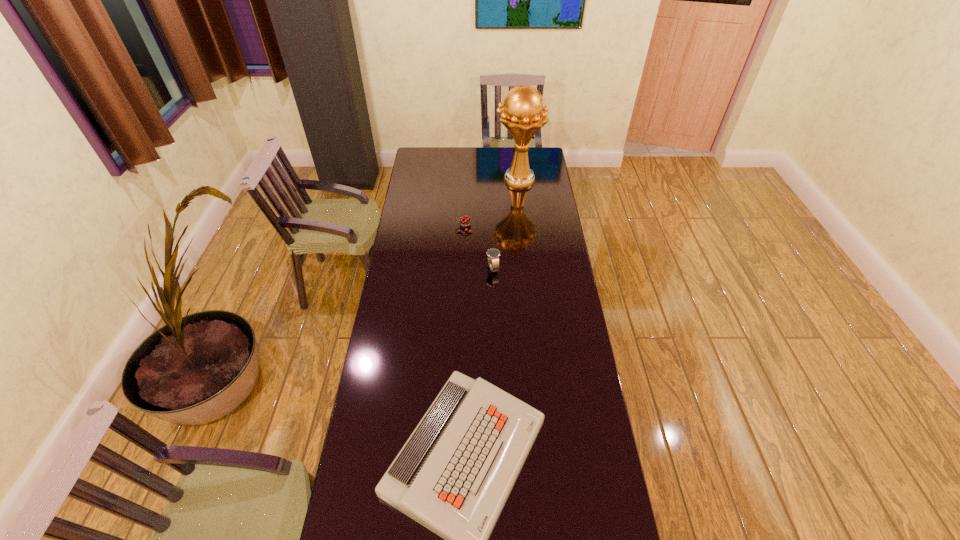
Find the location of a particular element. The height and width of the screenshot is (540, 960). vacant space situated on the handle side of the cherry is located at coordinates (427, 228).

Locate an element on the screen. This screenshot has height=540, width=960. object that is at the far edge is located at coordinates (523, 114).

The image size is (960, 540). I want to click on object at the right edge, so click(523, 114).

You are a GUI agent. You are given a task and a screenshot of the screen. Output one action in this format:
    pyautogui.click(x=<x>, y=<y>)
    Task: Click on the object positioned at the far right corner
    This screenshot has width=960, height=540.
    Given the screenshot: What is the action you would take?
    pyautogui.click(x=523, y=114)

At what (x,y) coordinates should I click in order to perform the action: click on vacant space at the far edge of the desktop. Please return your answer as a coordinate pair (x, y). The height and width of the screenshot is (540, 960). Looking at the image, I should click on (484, 160).

Where is `free point at the left edge`? Image resolution: width=960 pixels, height=540 pixels. free point at the left edge is located at coordinates (408, 186).

In the image, there is a desktop. Where is `free space at the right edge`? This screenshot has height=540, width=960. free space at the right edge is located at coordinates (568, 274).

Find the location of a particular element. Image resolution: width=960 pixels, height=540 pixels. empty location between the watch and the cherry is located at coordinates (478, 248).

The image size is (960, 540). In order to click on unoccupied position between the watch and the cherry in this screenshot , I will do `click(478, 248)`.

At what (x,y) coordinates should I click in order to perform the action: click on free space between the watch and the third nearest object. Please return your answer as a coordinate pair (x, y). The height and width of the screenshot is (540, 960). Looking at the image, I should click on (478, 248).